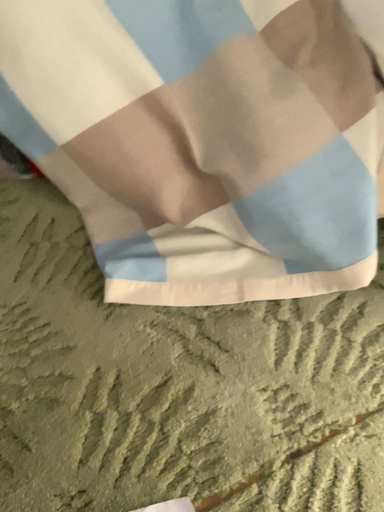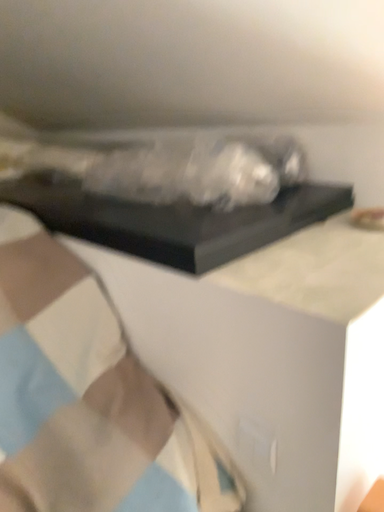
Question: How did the camera likely rotate when shooting the video?

Choices:
 (A) rotated right
 (B) rotated left

Answer: (A)